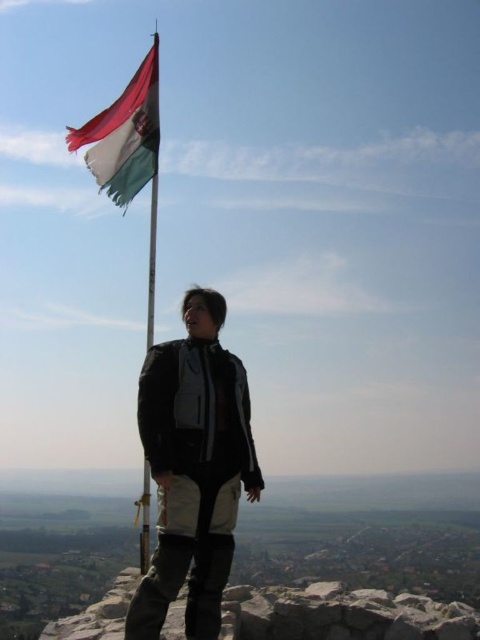
From the picture: You are planning to place a new decorative stone next to the rough stone at lower center and the metallic flagpole at upper left. Which object should you consider in terms of width when choosing the size of the new stone?

The rough stone at lower center is wider than the metallic flagpole at upper left. Therefore, you should consider the width of the rough stone at lower center to ensure the new decorative stone complements the existing objects appropriately.

From the picture: What is located at the coordinates point (124, 134) in the image?

At point (124, 134) lies the tri_color fabric flag at upper left.